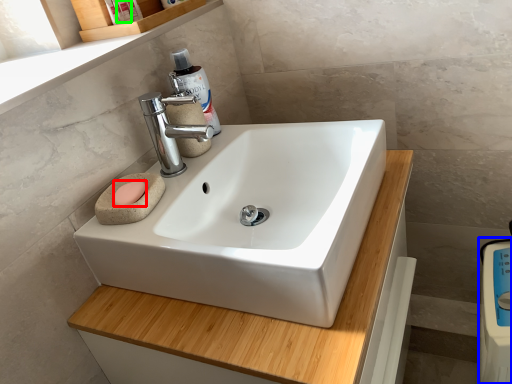
Question: Which object is positioned farthest from soap (highlighted by a red box)? Select from appliance (highlighted by a blue box) and toiletry (highlighted by a green box).

Choices:
 (A) appliance
 (B) toiletry

Answer: (A)